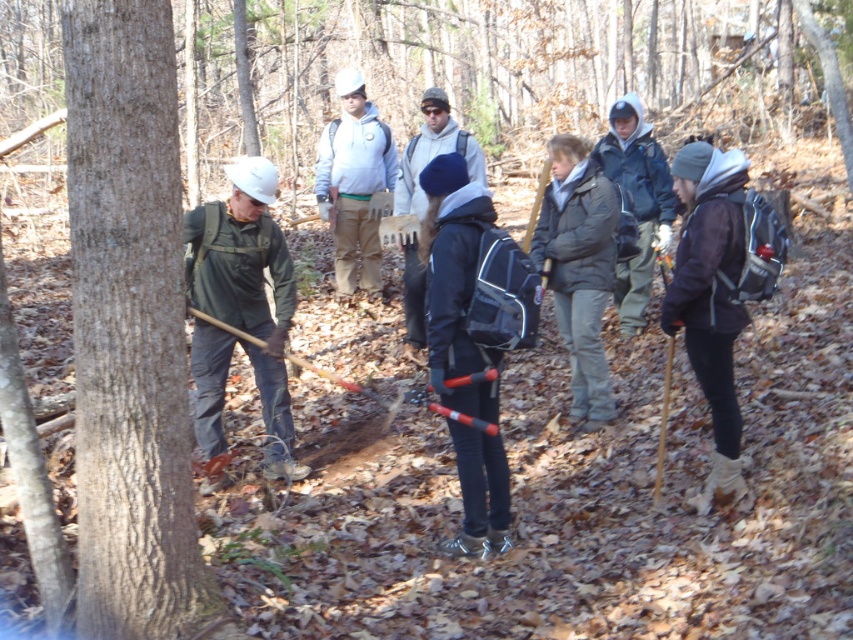
You are a hiker trying to reach the matte black backpack at center located in the middle of a forest path. There is a brown rough bark tree at left blocking your way. Can you walk around the tree to reach the backpack?

The brown rough bark tree at left is positioned on the left side of matte black backpack at center, so you can walk around the tree to the right side to reach the matte black backpack at center.